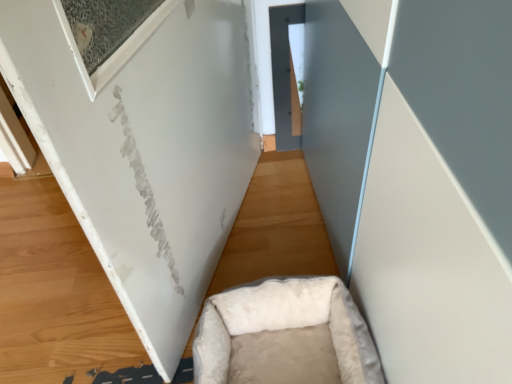
Question: Can you confirm if white fluffy pet bed at lower center is shorter than white plush pet bed at lower center?

Choices:
 (A) yes
 (B) no

Answer: (A)

Question: Is white fluffy pet bed at lower center not inside white plush pet bed at lower center?

Choices:
 (A) no
 (B) yes

Answer: (B)

Question: From a real-world perspective, is white fluffy pet bed at lower center on white plush pet bed at lower center?

Choices:
 (A) no
 (B) yes

Answer: (A)

Question: Does white fluffy pet bed at lower center have a larger size compared to white plush pet bed at lower center?

Choices:
 (A) no
 (B) yes

Answer: (B)

Question: From the image's perspective, would you say white fluffy pet bed at lower center is shown under white plush pet bed at lower center?

Choices:
 (A) yes
 (B) no

Answer: (B)

Question: Are white fluffy pet bed at lower center and white plush pet bed at lower center far apart?

Choices:
 (A) no
 (B) yes

Answer: (A)

Question: Considering the relative sizes of white plush pet bed at lower center and white fluffy pet bed at lower center in the image provided, is white plush pet bed at lower center thinner than white fluffy pet bed at lower center?

Choices:
 (A) no
 (B) yes

Answer: (B)

Question: Is white plush pet bed at lower center at the right side of white fluffy pet bed at lower center?

Choices:
 (A) yes
 (B) no

Answer: (A)

Question: From the image's perspective, is white plush pet bed at lower center under white fluffy pet bed at lower center?

Choices:
 (A) yes
 (B) no

Answer: (A)

Question: From a real-world perspective, is white plush pet bed at lower center positioned under white fluffy pet bed at lower center based on gravity?

Choices:
 (A) no
 (B) yes

Answer: (A)

Question: Does white plush pet bed at lower center have a lesser height compared to white fluffy pet bed at lower center?

Choices:
 (A) no
 (B) yes

Answer: (A)

Question: Does white plush pet bed at lower center come in front of white fluffy pet bed at lower center?

Choices:
 (A) no
 (B) yes

Answer: (B)

Question: Considering the positions of white fluffy pet bed at lower center and white plush pet bed at lower center in the image, is white fluffy pet bed at lower center wider or thinner than white plush pet bed at lower center?

Choices:
 (A) wide
 (B) thin

Answer: (A)